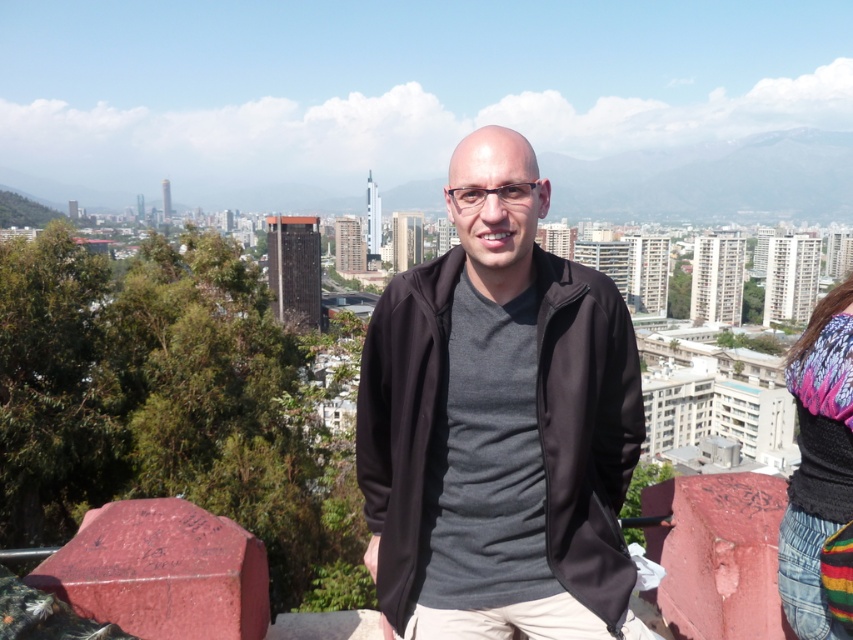
You are a drone operator trying to capture a photo of the cityscape from above. You have two points marked on your map for drone navigation. The first point is at coordinate point [583,602], and the second is at point [809,500]. According to the image, which point is closer to the camera? Please answer based on their positions in the scene.

Point [583,602] is in front of point [809,500], so it is closer to the camera.

You are a fashion designer observing the scene. You need to decide which clothing item is closer to you for a closer inspection. Which one should you choose between the black matte jacket at center and the knitted multicolor sweater at right?

The black matte jacket at center is closer to you than the knitted multicolor sweater at right, so you should choose the black matte jacket at center for closer inspection.

You are a fashion designer observing a person dressed in a black matte jacket at center and a knitted multicolor sweater at right. Which clothing item is positioned higher on the person?

The black matte jacket at center is positioned higher on the person than the knitted multicolor sweater at right because it is located above it.